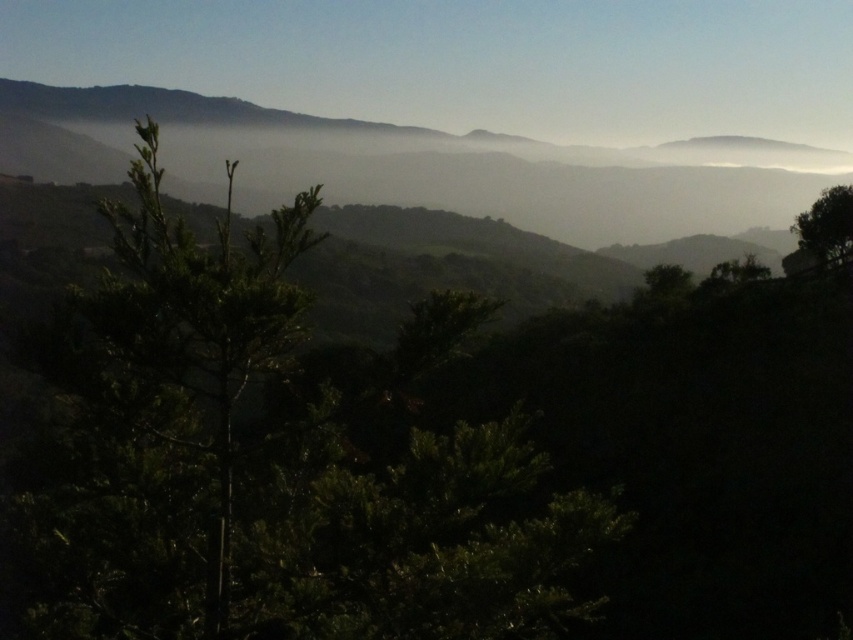
Can you confirm if green matte tree at center is smaller than silvery misty mountain at upper center?

Yes.

Between green matte tree at center and silvery misty mountain at upper center, which one has less height?

With less height is green matte tree at center.

Which is in front, point (480, 573) or point (183, 124)?

Point (480, 573) is more forward.

The height and width of the screenshot is (640, 853). Identify the location of green matte tree at center. (270, 460).

Is silvery misty mountain at upper center closer to camera compared to green leafy tree at right?

No, it is not.

Is point (349, 141) positioned in front of point (851, 205)?

That is False.

I want to click on silvery misty mountain at upper center, so click(x=456, y=164).

Can you confirm if green matte tree at center is positioned below green leafy tree at right?

Correct, green matte tree at center is located below green leafy tree at right.

Is green matte tree at center taller than green leafy tree at right?

Correct, green matte tree at center is much taller as green leafy tree at right.

Measure the distance between green matte tree at center and camera.

The distance of green matte tree at center from camera is 7.94 meters.

This screenshot has width=853, height=640. I want to click on green matte tree at center, so click(x=270, y=460).